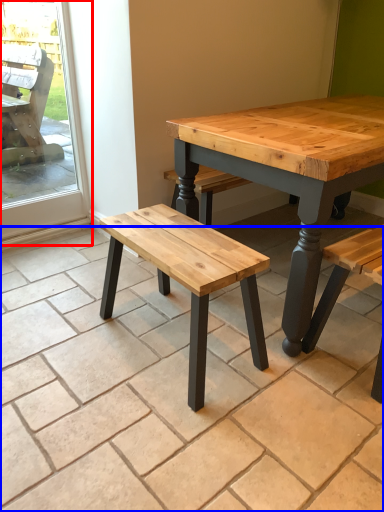
Question: Which point is closer to the camera, screen door (highlighted by a red box) or tile (highlighted by a blue box)?

Choices:
 (A) screen door
 (B) tile

Answer: (B)